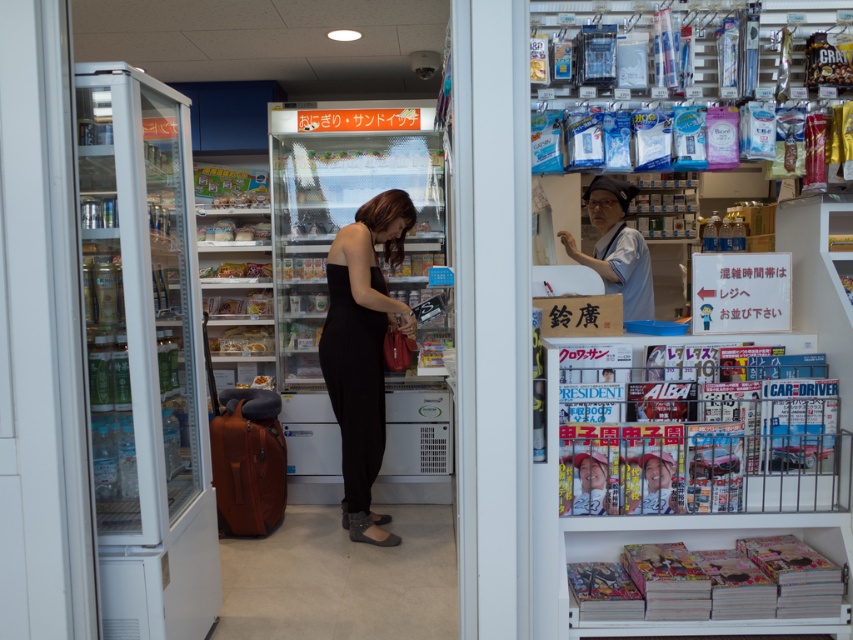
Is point (647, 467) less distant than point (589, 483)?

No, it is not.

Image resolution: width=853 pixels, height=640 pixels. I want to click on matte black magazine at center, so click(x=659, y=481).

Does black matte dress at center have a larger size compared to matte black dress at center?

Yes, black matte dress at center is bigger than matte black dress at center.

Which is above, black matte dress at center or matte black dress at center?

Positioned higher is black matte dress at center.

Which is in front, point (337, 275) or point (614, 458)?

Point (614, 458) is in front.

Identify the location of black matte dress at center. (363, 349).

Describe the element at coordinates (363, 349) in the screenshot. The height and width of the screenshot is (640, 853). I see `black matte dress at center` at that location.

Does point (376, 428) lie behind point (587, 200)?

No, (376, 428) is closer to viewer.

This screenshot has width=853, height=640. Find the location of `black matte dress at center`. black matte dress at center is located at coordinates (363, 349).

What are the coordinates of `black matte dress at center` in the screenshot? It's located at (363, 349).